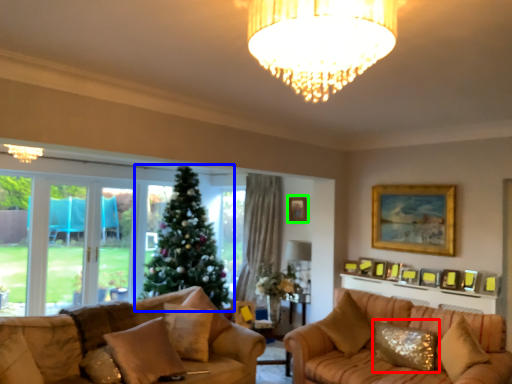
Question: Which object is the farthest from pillow (highlighted by a red box)? Choose among these: christmas tree (highlighted by a blue box) or picture frame (highlighted by a green box).

Choices:
 (A) christmas tree
 (B) picture frame

Answer: (A)